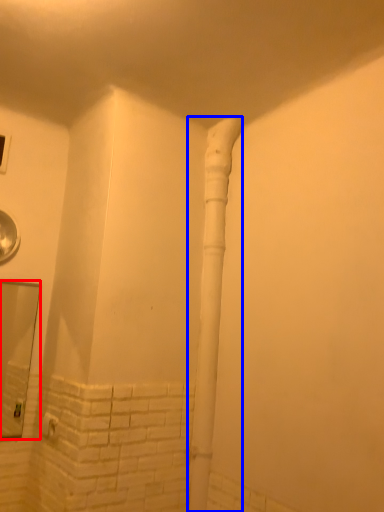
Question: Which of the following is the farthest to the observer, mirror (highlighted by a red box) or water pipe (highlighted by a blue box)?

Choices:
 (A) mirror
 (B) water pipe

Answer: (A)